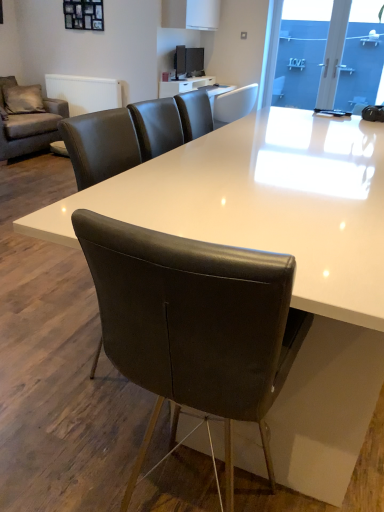
Identify the location of blank area to the left of leather at center, the 1th chair positioned from the front. (79, 467).